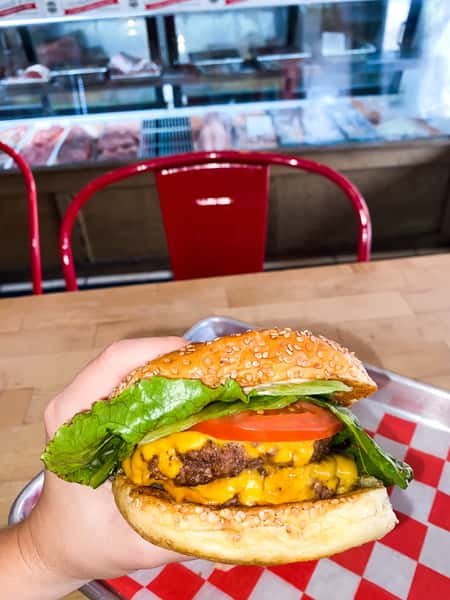
Locate an element on the screen. The image size is (450, 600). sheet is located at coordinates (396, 568).